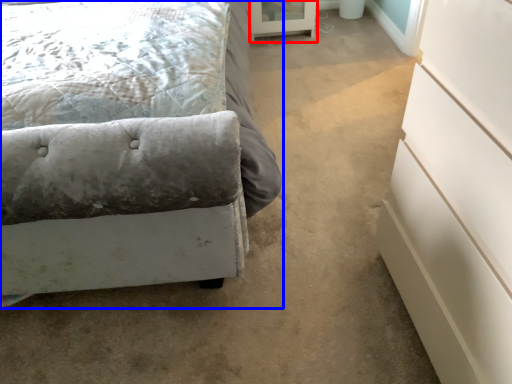
Question: Which point is further to the camera, screen door (highlighted by a red box) or bed (highlighted by a blue box)?

Choices:
 (A) screen door
 (B) bed

Answer: (A)